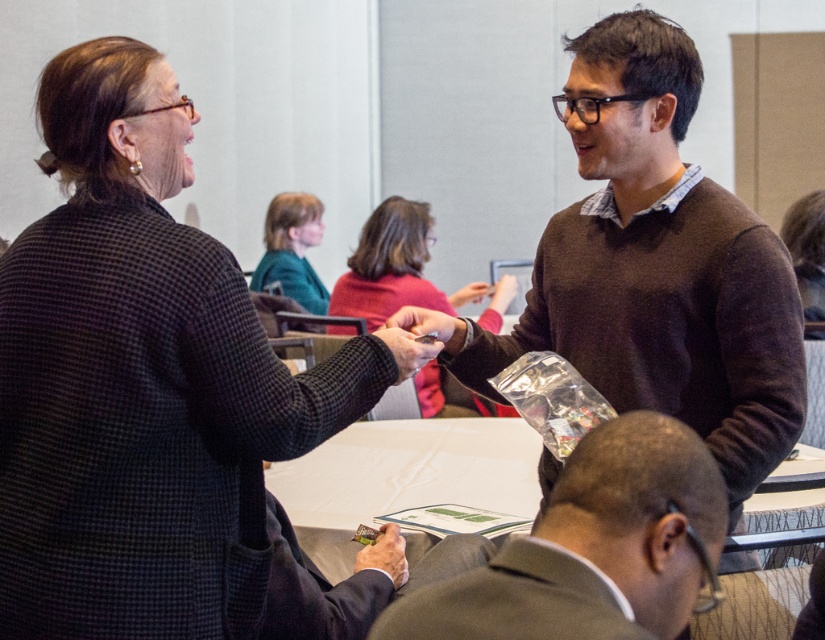
Question: Does gray suit jacket at lower center appear on the left side of teal fabric jacket at upper center?

Choices:
 (A) yes
 (B) no

Answer: (B)

Question: Estimate the real-world distances between objects in this image. Which object is closer to the teal fabric jacket at upper center?

Choices:
 (A) brown sweater at upper right
 (B) gray suit jacket at lower center
 (C) black textured coat at upper left
 (D) matte red sweater at center

Answer: (D)

Question: Which point is farther to the camera?

Choices:
 (A) brown sweater at upper right
 (B) teal fabric jacket at upper center
 (C) gray suit jacket at lower center

Answer: (B)

Question: Where is gray suit jacket at lower center located in relation to matte red sweater at center in the image?

Choices:
 (A) right
 (B) left

Answer: (A)

Question: Among these points, which one is nearest to the camera?

Choices:
 (A) (409, 220)
 (B) (792, 332)
 (C) (676, 595)

Answer: (C)

Question: Can you confirm if matte red sweater at center is positioned to the left of teal fabric jacket at upper center?

Choices:
 (A) yes
 (B) no

Answer: (B)